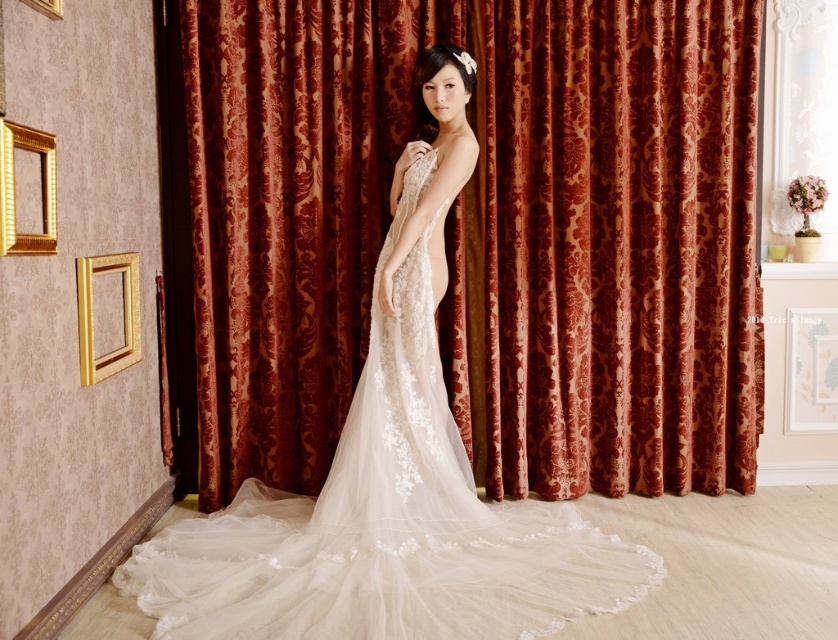
Does velvet-like burgundy curtain at center appear over white lace dress at center?

Correct, velvet-like burgundy curtain at center is located above white lace dress at center.

Between point (759, 298) and point (463, 550), which one is positioned in front?

Positioned in front is point (463, 550).

The width and height of the screenshot is (838, 640). I want to click on velvet-like burgundy curtain at center, so click(x=484, y=236).